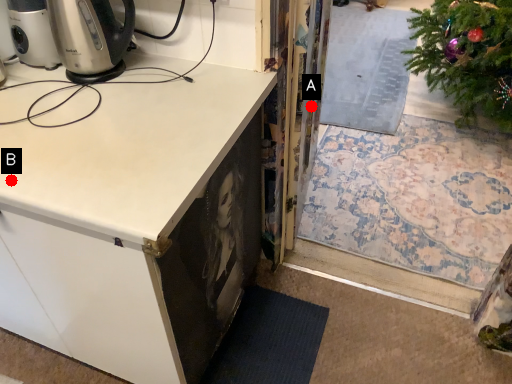
Question: Two points are circled on the image, labeled by A and B beside each circle. Which of the following is the farthest from the observer?

Choices:
 (A) A is further
 (B) B is further

Answer: (A)